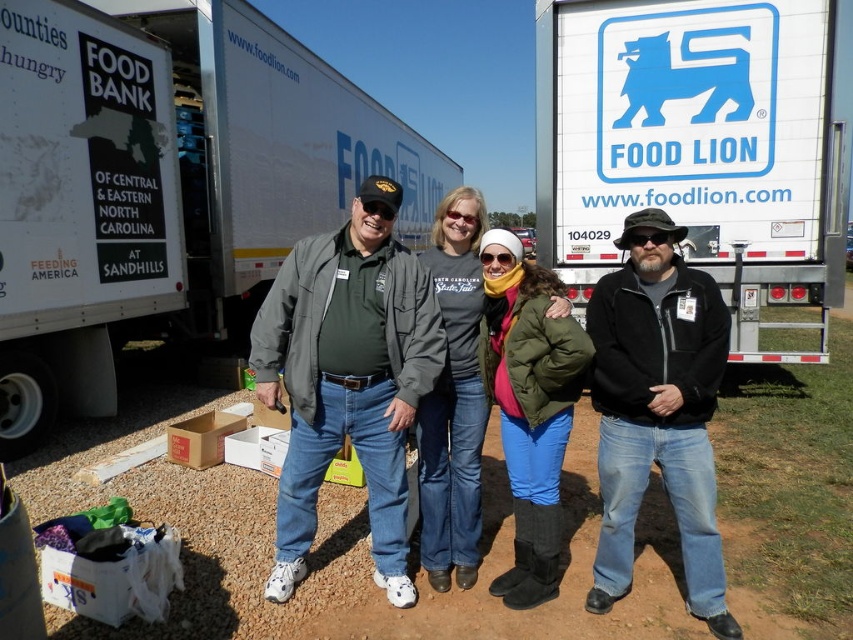
Who is positioned more to the right, white matte truck at right or black fleece jacket at center?

From the viewer's perspective, white matte truck at right appears more on the right side.

Is the position of white matte truck at right less distant than that of black fleece jacket at center?

No, white matte truck at right is behind black fleece jacket at center.

Find the location of a particular element. white matte truck at right is located at coordinates (700, 145).

You are a GUI agent. You are given a task and a screenshot of the screen. Output one action in this format:
    pyautogui.click(x=<x>, y=<y>)
    Task: Click on the white matte truck at right
    The width and height of the screenshot is (853, 640).
    Given the screenshot: What is the action you would take?
    pyautogui.click(x=700, y=145)

Describe the element at coordinates (164, 184) in the screenshot. I see `white matte truck at upper center` at that location.

Can you confirm if white matte truck at upper center is positioned below green puffy jacket at center?

No, white matte truck at upper center is not below green puffy jacket at center.

You are a GUI agent. You are given a task and a screenshot of the screen. Output one action in this format:
    pyautogui.click(x=<x>, y=<y>)
    Task: Click on the white matte truck at upper center
    
    Given the screenshot: What is the action you would take?
    pyautogui.click(x=164, y=184)

Image resolution: width=853 pixels, height=640 pixels. What are the coordinates of `white matte truck at upper center` in the screenshot? It's located at (164, 184).

Does black fleece jacket at center appear on the left side of green puffy jacket at center?

No, black fleece jacket at center is not to the left of green puffy jacket at center.

Can you confirm if black fleece jacket at center is smaller than green puffy jacket at center?

Actually, black fleece jacket at center might be larger than green puffy jacket at center.

Who is more distant from viewer, (700, 296) or (521, 413)?

The point (521, 413) is more distant.

The image size is (853, 640). In order to click on black fleece jacket at center in this screenshot , I will do `click(659, 413)`.